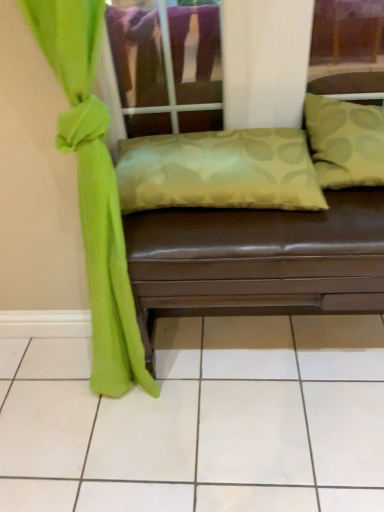
Question: Should I look upward or downward to see silky green pillow at center?

Choices:
 (A) up
 (B) down

Answer: (B)

Question: Are silky green pillow at center and satin green pillow at center, placed as the 1th pillow when sorted from left to right, located far from each other?

Choices:
 (A) yes
 (B) no

Answer: (B)

Question: Considering the relative sizes of silky green pillow at center and satin green pillow at center, placed as the 1th pillow when sorted from left to right, in the image provided, is silky green pillow at center bigger than satin green pillow at center, placed as the 1th pillow when sorted from left to right,?

Choices:
 (A) no
 (B) yes

Answer: (B)

Question: Is silky green pillow at center aimed at satin green pillow at center, placed as the 2th pillow when sorted from right to left?

Choices:
 (A) no
 (B) yes

Answer: (A)

Question: Is silky green pillow at center taller than satin green pillow at center, placed as the 1th pillow when sorted from left to right?

Choices:
 (A) yes
 (B) no

Answer: (A)

Question: From a real-world perspective, is silky green pillow at center positioned over satin green pillow at center, placed as the 1th pillow when sorted from left to right, based on gravity?

Choices:
 (A) yes
 (B) no

Answer: (B)

Question: Is silky green pillow at center facing away from satin green pillow at center, placed as the 1th pillow when sorted from left to right?

Choices:
 (A) no
 (B) yes

Answer: (A)

Question: From a real-world perspective, is green fabric pillow at upper right, which is the second pillow in left-to-right order, positioned over green fabric curtain at left based on gravity?

Choices:
 (A) yes
 (B) no

Answer: (A)

Question: Is green fabric curtain at left at the back of green fabric pillow at upper right, which ranks as the 1th pillow in right-to-left order?

Choices:
 (A) no
 (B) yes

Answer: (A)

Question: Could you tell me if green fabric pillow at upper right, which is the second pillow in left-to-right order, is facing green fabric curtain at left?

Choices:
 (A) yes
 (B) no

Answer: (B)

Question: Does green fabric pillow at upper right, which ranks as the 1th pillow in right-to-left order, have a lesser width compared to green fabric curtain at left?

Choices:
 (A) yes
 (B) no

Answer: (B)

Question: Can you confirm if green fabric pillow at upper right, which ranks as the 1th pillow in right-to-left order, is wider than green fabric curtain at left?

Choices:
 (A) yes
 (B) no

Answer: (A)

Question: Is the position of green fabric pillow at upper right, which is the second pillow in left-to-right order, more distant than that of green fabric curtain at left?

Choices:
 (A) yes
 (B) no

Answer: (A)

Question: Can you confirm if green fabric pillow at upper right, which ranks as the 1th pillow in right-to-left order, is wider than satin green pillow at center, placed as the 2th pillow when sorted from right to left?

Choices:
 (A) no
 (B) yes

Answer: (B)